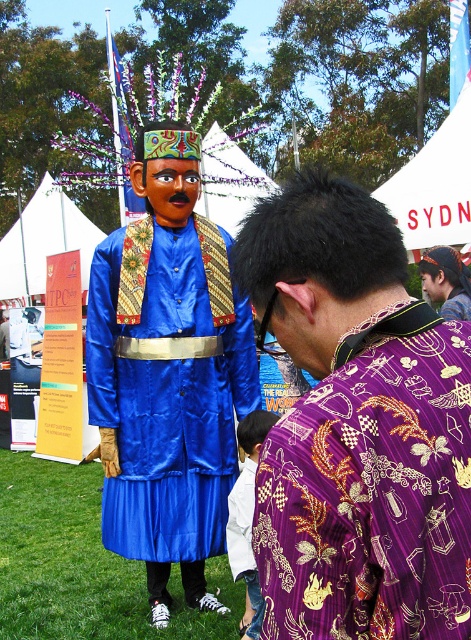
Question: Which object is closer to the camera taking this photo?

Choices:
 (A) blue satin robe at left
 (B) blue satin figure at left
 (C) white cotton shirt at lower center

Answer: (B)

Question: Can you confirm if blue satin figure at left is smaller than purple batik shirt at center?

Choices:
 (A) no
 (B) yes

Answer: (A)

Question: Which point appears closest to the camera in this image?

Choices:
 (A) (397, 589)
 (B) (276, 416)
 (C) (159, 490)

Answer: (A)

Question: Is blue satin figure at left positioned at the back of blue satin robe at left?

Choices:
 (A) no
 (B) yes

Answer: (A)

Question: Does blue satin figure at left have a smaller size compared to blue satin robe at left?

Choices:
 (A) yes
 (B) no

Answer: (A)

Question: Which of the following is the farthest from the observer?

Choices:
 (A) (205, 515)
 (B) (449, 307)

Answer: (B)